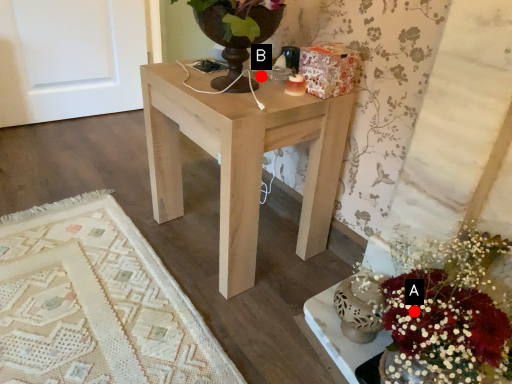
Question: Two points are circled on the image, labeled by A and B beside each circle. Which point is further to the camera?

Choices:
 (A) A is further
 (B) B is further

Answer: (B)